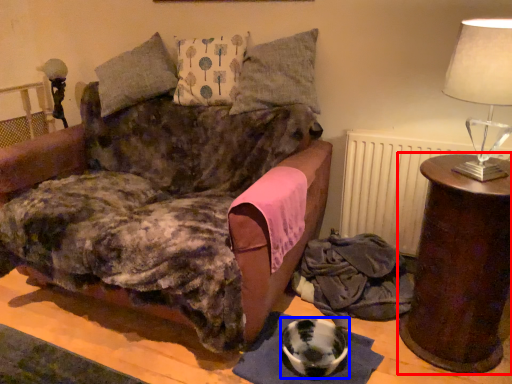
Question: Which point is closer to the camera, table (highlighted by a red box) or bowl (highlighted by a blue box)?

Choices:
 (A) table
 (B) bowl

Answer: (A)